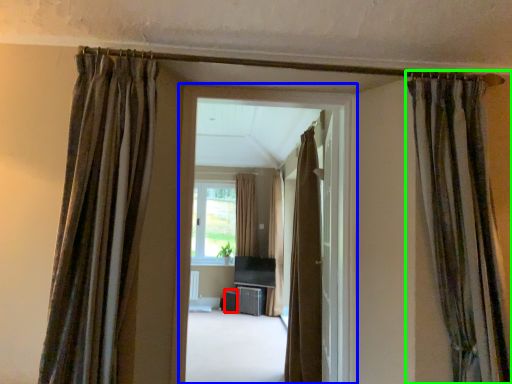
Question: Estimate the real-world distances between objects in this image. Which object is farther from furniture (highlighted by a red box), window frame (highlighted by a blue box) or curtain (highlighted by a green box)?

Choices:
 (A) window frame
 (B) curtain

Answer: (B)